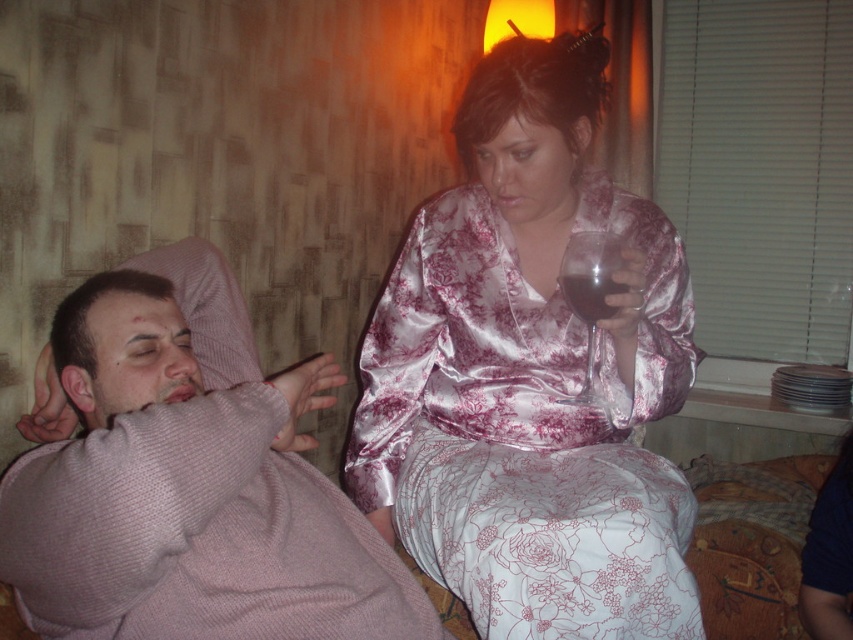
Question: Which of the following is the closest to the observer?

Choices:
 (A) (611, 456)
 (B) (74, 566)
 (C) (596, 340)
 (D) (587, 310)

Answer: (B)

Question: Observing the image, what is the correct spatial positioning of transparent glass at upper center in reference to dark glass at upper center?

Choices:
 (A) below
 (B) above

Answer: (A)

Question: Which of these objects is positioned farthest from the transparent glass at upper center?

Choices:
 (A) dark glass at upper center
 (B) pink knitted sweater at left
 (C) satin floral dress at upper center

Answer: (B)

Question: Which object appears farthest from the camera in this image?

Choices:
 (A) dark glass at upper center
 (B) satin floral dress at upper center
 (C) pink knitted sweater at left
 (D) transparent glass at upper center

Answer: (A)

Question: Is satin floral dress at upper center closer to the viewer compared to dark glass at upper center?

Choices:
 (A) yes
 (B) no

Answer: (A)

Question: Is pink knitted sweater at left thinner than transparent glass at upper center?

Choices:
 (A) yes
 (B) no

Answer: (B)